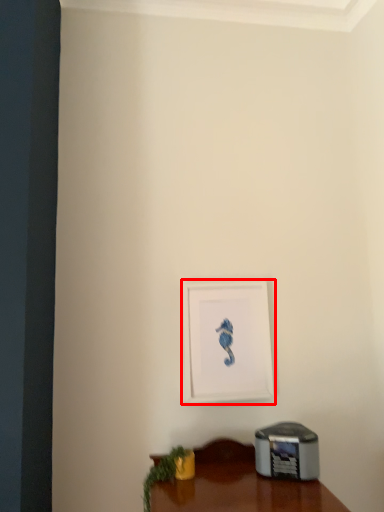
Question: Where is picture frame (annotated by the red box) located in relation to plant in the image?

Choices:
 (A) left
 (B) right

Answer: (B)